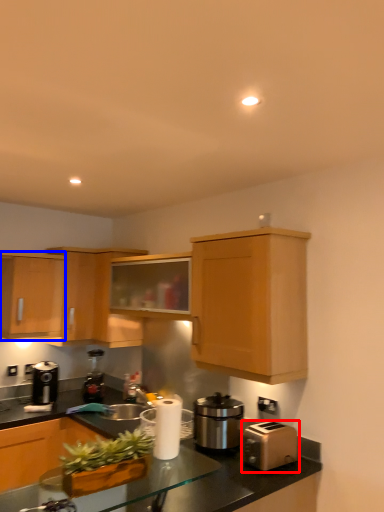
Question: Which object is closer to the camera taking this photo, toaster (highlighted by a red box) or cabinetry (highlighted by a blue box)?

Choices:
 (A) toaster
 (B) cabinetry

Answer: (A)